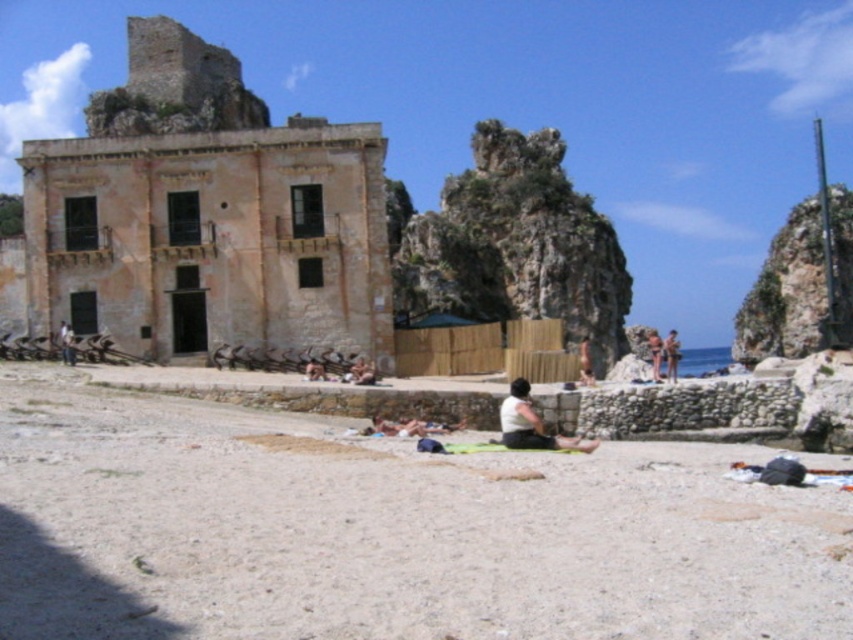
You are standing on the sandy beach and want to take a photo of the weathered stone ruins at center and the matte black person at lower left. To ensure both are in frame, which object should you position closer to the camera?

The weathered stone ruins at center is taller than the matte black person at lower left, so you should position the matte black person at lower left closer to the camera to ensure both are in frame.

You are standing on the sandy beach and want to reach the weathered stone ruins at center. Which direction should you move relative to the matte black person at lower left?

You should move to the right relative to the matte black person at lower left because the weathered stone ruins at center is positioned on the left side of the matte black person at lower left.